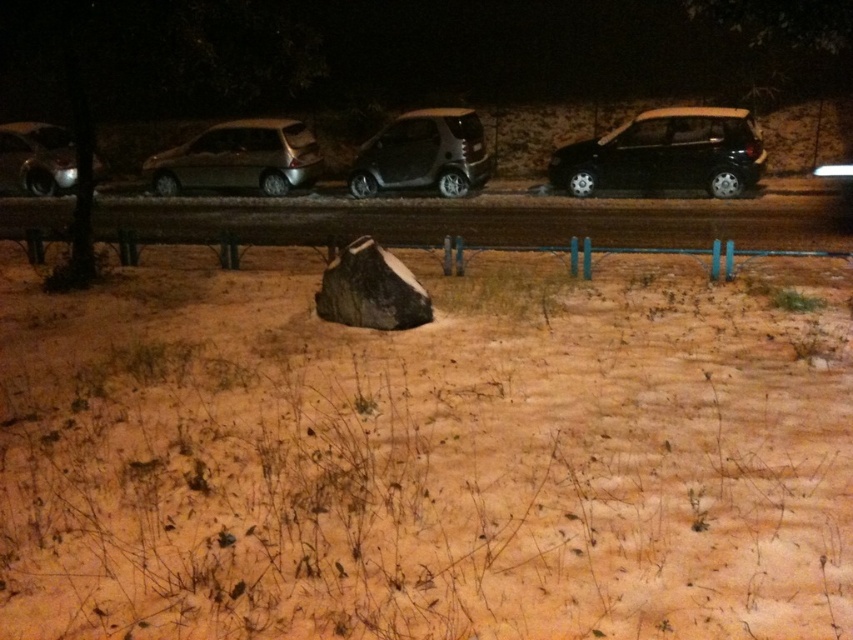
You are a delivery person needing to park your vehicle between the metallic silver hatchback at center and the satin black car at center. Which car should you position your vehicle closer to if you want to maximize parking space?

You should position your vehicle closer to the metallic silver hatchback at center because it is smaller than the satin black car at center, providing more space for parking.

You are a delivery person trying to park your delivery van between the black matte hatchback at right and the shiny silver car at left. Can you estimate if there is enough space between them to fit your van which is 2 meters wide?

The black matte hatchback at right might be wider than shiny silver car at left, so there might not be enough space between them to fit a 2 meter wide van. It is safer to look for another parking spot.

You are a delivery person trying to park your vehicle in the area shown. You see the brown sandy dirt at center and the shiny silver car at left. Which location is more suitable for parking your vehicle?

The shiny silver car at left is already parked in a suitable location, while the brown sandy dirt at center is located below it and may not be a designated parking spot. It is recommended to park where the shiny silver car at left is positioned.